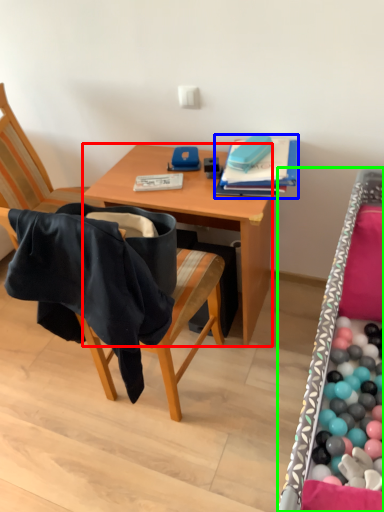
Question: Estimate the real-world distances between objects in this image. Which object is closer to desk (highlighted by a red box), book (highlighted by a blue box) or bed frame (highlighted by a green box)?

Choices:
 (A) book
 (B) bed frame

Answer: (A)